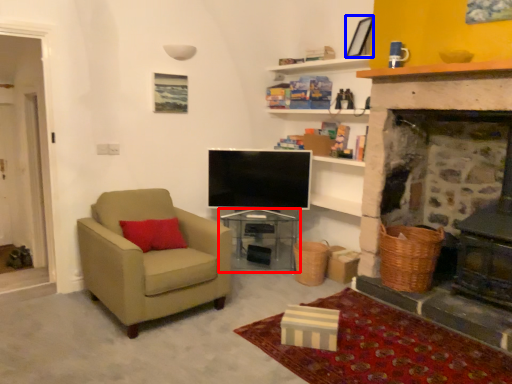
Question: Which object is further to the camera taking this photo, table (highlighted by a red box) or picture frame (highlighted by a blue box)?

Choices:
 (A) table
 (B) picture frame

Answer: (A)